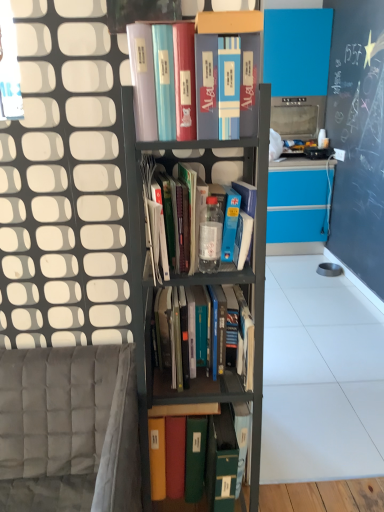
Question: Considering the positions of matte plastic books at upper center, the 1th book when ordered from top to bottom, and green matte folder at center, which is the 4th book in top-to-bottom order, in the image, is matte plastic books at upper center, the 1th book when ordered from top to bottom, bigger or smaller than green matte folder at center, which is the 4th book in top-to-bottom order,?

Choices:
 (A) small
 (B) big

Answer: (A)

Question: Choose the correct answer: Is matte plastic books at upper center, the 1th book when ordered from top to bottom, inside green matte folder at center, the first book ordered from the bottom, or outside it?

Choices:
 (A) inside
 (B) outside

Answer: (B)

Question: Which object is the farthest from the metallic gray bookshelf at center?

Choices:
 (A) matte plastic books at upper center, the 1th book when ordered from top to bottom
 (B) translucent plastic bottle at center, positioned as the 3th book in bottom-to-top order
 (C) hardcover books at center, the 3th book in the top-to-bottom sequence
 (D) green matte folder at center, the first book ordered from the bottom
 (E) gray fabric armchair at lower left

Answer: (D)

Question: Based on their relative distances, which object is farther from the matte plastic books at upper center, the 1th book when ordered from top to bottom?

Choices:
 (A) green matte folder at center, the first book ordered from the bottom
 (B) metallic gray bookshelf at center
 (C) translucent plastic bottle at center, positioned as the 2th book in top-to-bottom order
 (D) hardcover books at center, the 3th book in the top-to-bottom sequence
 (E) gray fabric armchair at lower left

Answer: (A)